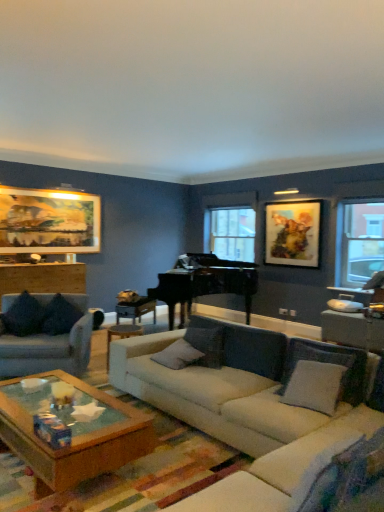
Question: Is dark gray fabric couch at left, placed as the second studio couch when sorted from right to left, far away from dark fabric pillow at left, which is the 4th pillow in right-to-left order?

Choices:
 (A) yes
 (B) no

Answer: (B)

Question: Considering the relative sizes of dark gray fabric couch at left, placed as the second studio couch when sorted from right to left, and dark fabric pillow at left, which is the 4th pillow in right-to-left order, in the image provided, is dark gray fabric couch at left, placed as the second studio couch when sorted from right to left, thinner than dark fabric pillow at left, which is the 4th pillow in right-to-left order,?

Choices:
 (A) yes
 (B) no

Answer: (B)

Question: Is dark gray fabric couch at left, the first studio couch when ordered from left to right, positioned behind dark fabric pillow at left, which appears as the second pillow when viewed from the left?

Choices:
 (A) yes
 (B) no

Answer: (B)

Question: From the image's perspective, is dark gray fabric couch at left, placed as the second studio couch when sorted from right to left, below dark fabric pillow at left, which is the 4th pillow in right-to-left order?

Choices:
 (A) yes
 (B) no

Answer: (A)

Question: Can you confirm if dark gray fabric couch at left, the first studio couch when ordered from left to right, is bigger than dark fabric pillow at left, which is the 4th pillow in right-to-left order?

Choices:
 (A) no
 (B) yes

Answer: (B)

Question: Is transparent glass window at right, which is the 1th window from right to left, in front of or behind velvet dark blue pillow at left, which is the 1th pillow from left to right, in the image?

Choices:
 (A) front
 (B) behind

Answer: (B)

Question: From a real-world perspective, relative to velvet dark blue pillow at left, acting as the fifth pillow starting from the right, is transparent glass window at right, which is the 1th window from right to left, vertically above or below?

Choices:
 (A) below
 (B) above

Answer: (B)

Question: Considering the positions of transparent glass window at right, which is the 1th window from right to left, and velvet dark blue pillow at left, acting as the fifth pillow starting from the right, in the image, is transparent glass window at right, which is the 1th window from right to left, bigger or smaller than velvet dark blue pillow at left, acting as the fifth pillow starting from the right,?

Choices:
 (A) small
 (B) big

Answer: (A)

Question: Is point (380, 199) positioned closer to the camera than point (36, 321)?

Choices:
 (A) closer
 (B) farther

Answer: (B)

Question: Considering the positions of wooden table at left, marked as the first table in a left-to-right arrangement, and clear glass window at center, which is counted as the second window, starting from the front, in the image, is wooden table at left, marked as the first table in a left-to-right arrangement, wider or thinner than clear glass window at center, which is counted as the second window, starting from the front,?

Choices:
 (A) wide
 (B) thin

Answer: (A)

Question: In terms of size, does wooden table at left, positioned as the second table in right-to-left order, appear bigger or smaller than clear glass window at center, arranged as the 1th window when viewed from the left?

Choices:
 (A) big
 (B) small

Answer: (A)

Question: From the image's perspective, relative to clear glass window at center, which is counted as the second window, starting from the front, is wooden table at left, marked as the 2th table in a front-to-back arrangement, above or below?

Choices:
 (A) below
 (B) above

Answer: (A)

Question: In the image, is wooden table at left, marked as the first table in a left-to-right arrangement, positioned in front of or behind clear glass window at center, which is counted as the second window, starting from the front?

Choices:
 (A) front
 (B) behind

Answer: (A)

Question: Is point (362, 276) closer or farther from the camera than point (216, 366)?

Choices:
 (A) farther
 (B) closer

Answer: (A)

Question: Is transparent glass window at right, which is the first window in front-to-back order, bigger or smaller than gray fabric pillow at center, which is the fourth pillow in left-to-right order?

Choices:
 (A) small
 (B) big

Answer: (A)